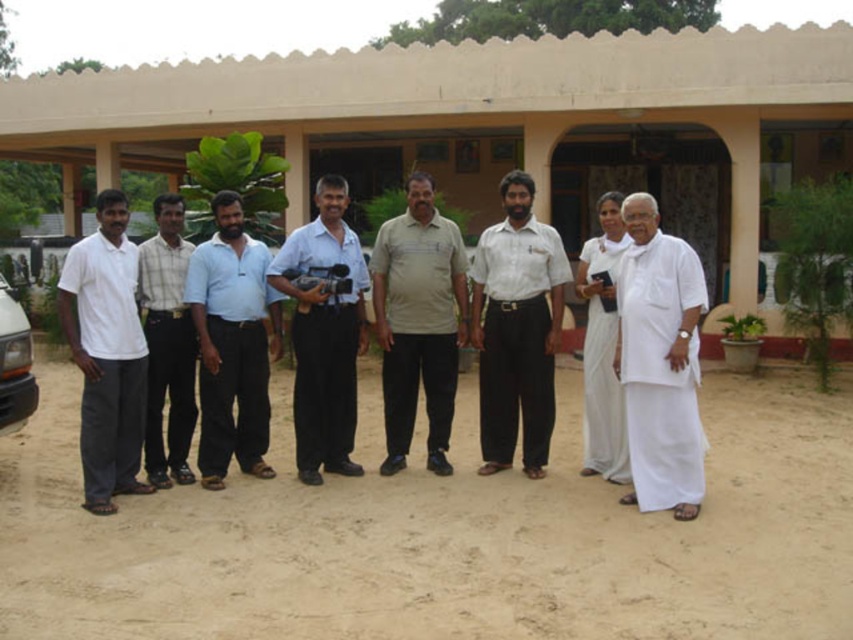
Question: Among these points, which one is nearest to the camera?

Choices:
 (A) (299, 403)
 (B) (78, 340)
 (C) (630, 385)

Answer: (B)

Question: Is beige cotton shirt at center smaller than white cloth at center?

Choices:
 (A) yes
 (B) no

Answer: (B)

Question: Where is white cotton dhoti at right located in relation to beige cotton shirt at center in the image?

Choices:
 (A) above
 (B) below

Answer: (B)

Question: Can you confirm if white cotton shirt at center is wider than white cloth at center?

Choices:
 (A) yes
 (B) no

Answer: (A)

Question: Which point is farther from the camera taking this photo?

Choices:
 (A) (102, 282)
 (B) (28, 406)
 (C) (148, 339)

Answer: (C)

Question: Based on their relative distances, which object is nearer to the white cotton dhoti at right?

Choices:
 (A) beige cotton shirt at center
 (B) light blue cotton shirt at center

Answer: (A)